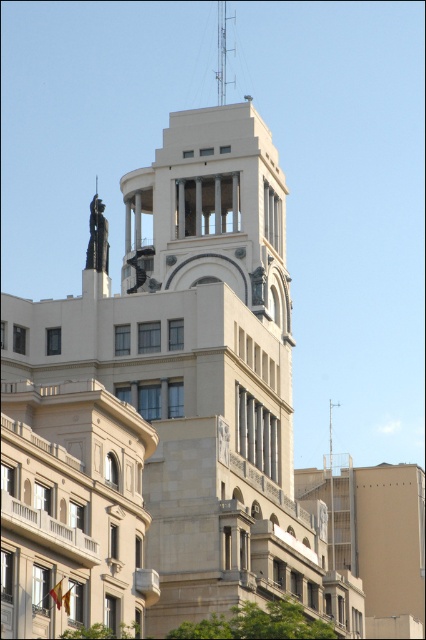
Question: Which object appears farthest from the camera in this image?

Choices:
 (A) metallic spire at upper center
 (B) satin bronze statue at upper center
 (C) polished bronze statue at upper center

Answer: (A)

Question: Is polished bronze statue at upper center smaller than metallic spire at upper center?

Choices:
 (A) no
 (B) yes

Answer: (A)

Question: From the image, what is the correct spatial relationship of polished bronze statue at upper center in relation to metallic spire at upper center?

Choices:
 (A) left
 (B) right

Answer: (A)

Question: Does polished bronze statue at upper center have a larger size compared to metallic spire at upper center?

Choices:
 (A) yes
 (B) no

Answer: (A)

Question: Which object is the farthest from the satin bronze statue at upper center?

Choices:
 (A) metallic spire at upper center
 (B) polished bronze statue at upper center

Answer: (A)

Question: Among these points, which one is farthest from the camera?

Choices:
 (A) (235, 10)
 (B) (94, 259)
 (C) (141, 248)

Answer: (A)